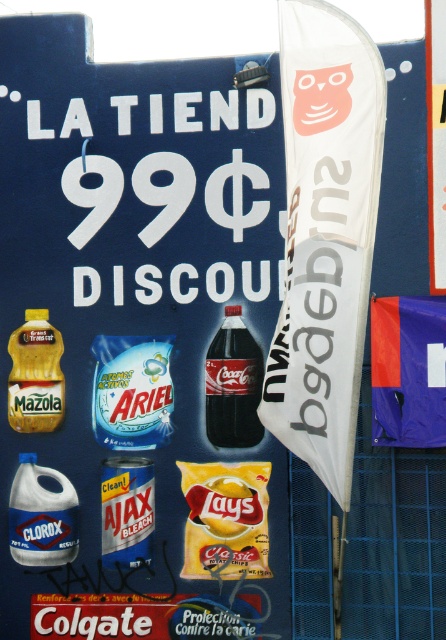
You are standing in front of the LA TIENDA advertisement and notice two points marked on it. Which point, point 1 at coordinates (x=161, y=376) or point 2 at (x=227, y=401), is closer to you?

Point 1 at coordinates (x=161, y=376) is closer to you because it is further to the camera than point 2 at (x=227, y=401).